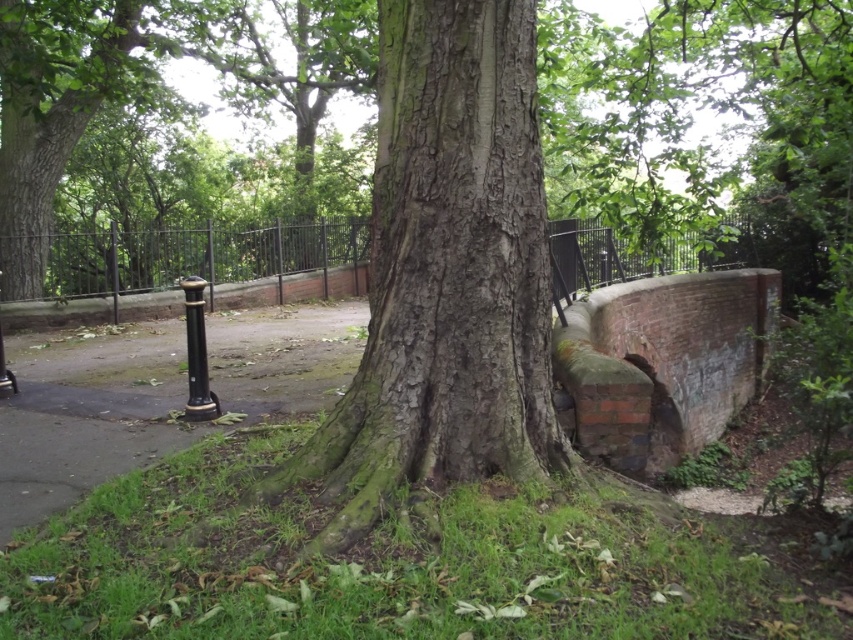
Question: Is smooth brown bark at center positioned behind black polished metal bollard at center-left?

Choices:
 (A) yes
 (B) no

Answer: (B)

Question: Considering the real-world distances, which object is farthest from the black metal fence at center?

Choices:
 (A) smooth brown bark at center
 (B) smooth bark tree trunk at center

Answer: (B)

Question: Which of the following is the closest to the observer?

Choices:
 (A) (402, 83)
 (B) (659, 180)
 (C) (190, 310)

Answer: (A)

Question: Which point is farther to the camera?

Choices:
 (A) smooth brown bark at center
 (B) smooth bark tree trunk at center

Answer: (A)

Question: Considering the relative positions of smooth brown bark at center and smooth bark tree trunk at center in the image provided, where is smooth brown bark at center located with respect to smooth bark tree trunk at center?

Choices:
 (A) left
 (B) right

Answer: (B)

Question: Can you confirm if smooth bark tree trunk at center is thinner than black metal fence at center?

Choices:
 (A) no
 (B) yes

Answer: (B)